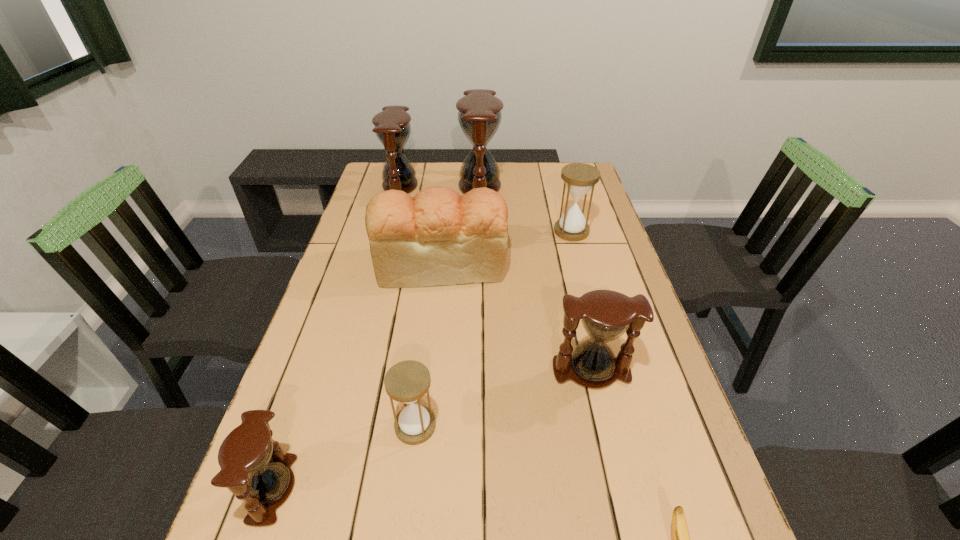
This screenshot has width=960, height=540. Find the location of `object that is at the far left corner`. object that is at the far left corner is located at coordinates 392,127.

You are a GUI agent. You are given a task and a screenshot of the screen. Output one action in this format:
    pyautogui.click(x=<x>, y=<y>)
    Task: Click on the vacant space at the far edge of the desktop
    
    Given the screenshot: What is the action you would take?
    pyautogui.click(x=431, y=171)

This screenshot has width=960, height=540. I want to click on vacant space at the left edge of the desktop, so click(x=351, y=239).

In the image, there is a desktop. Where is `free space at the right edge`? This screenshot has height=540, width=960. free space at the right edge is located at coordinates (640, 368).

Locate an element on the screen. vacant space at the far left corner of the desktop is located at coordinates (372, 175).

This screenshot has height=540, width=960. I want to click on blank region between the third nearest object and the smallest brown hourglass, so click(344, 457).

In order to click on free area in between the third hourglass from right to left and the smallest brown hourglass in this screenshot , I will do `click(376, 338)`.

This screenshot has width=960, height=540. Find the location of `free space between the nearest hourglass and the third smallest brown hourglass`. free space between the nearest hourglass and the third smallest brown hourglass is located at coordinates (337, 338).

Where is `vacant area that lies between the farther white hourglass and the nearest hourglass`? The height and width of the screenshot is (540, 960). vacant area that lies between the farther white hourglass and the nearest hourglass is located at coordinates (422, 360).

Where is `free space between the smallest brown hourglass and the fourth farthest object`? Image resolution: width=960 pixels, height=540 pixels. free space between the smallest brown hourglass and the fourth farthest object is located at coordinates (357, 376).